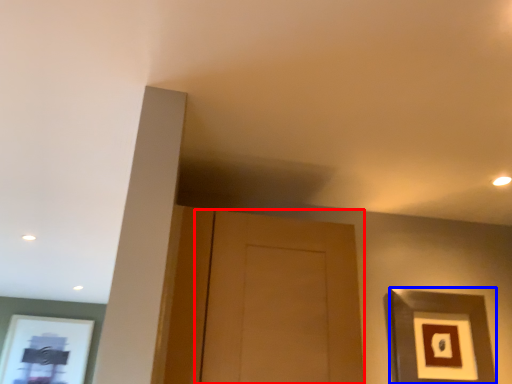
Question: Which object is closer to the camera taking this photo, door (highlighted by a red box) or picture frame (highlighted by a blue box)?

Choices:
 (A) door
 (B) picture frame

Answer: (A)